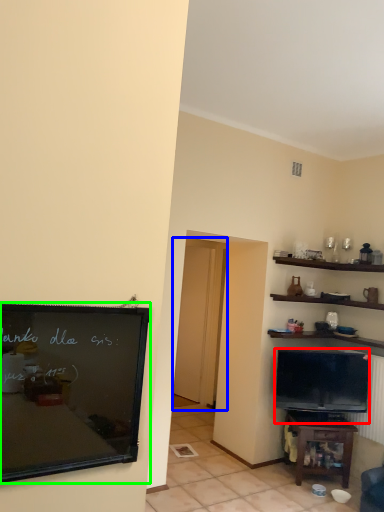
Question: Which object is positioned closest to television (highlighted by a red box)? Select from glass door (highlighted by a blue box) and bulletin board (highlighted by a green box).

Choices:
 (A) glass door
 (B) bulletin board

Answer: (A)